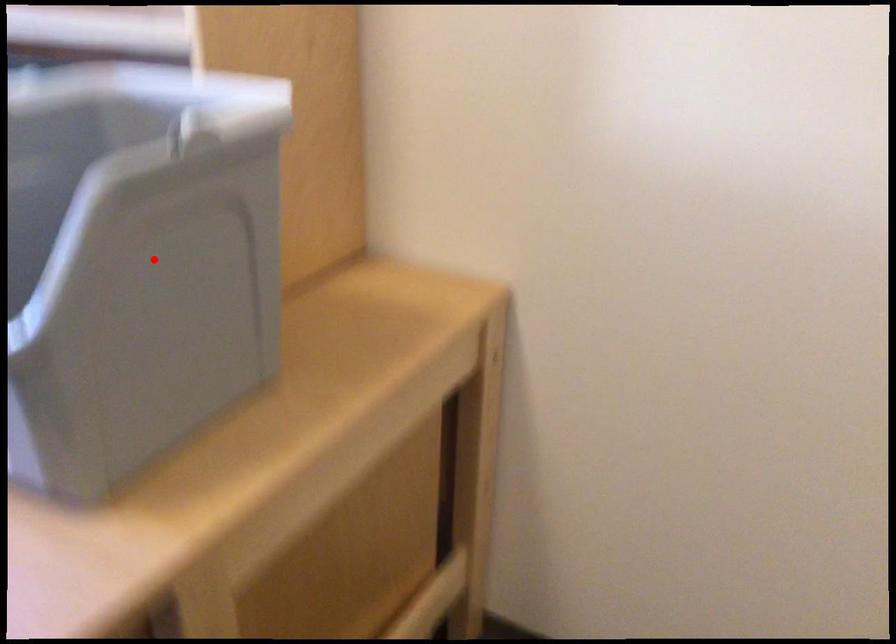
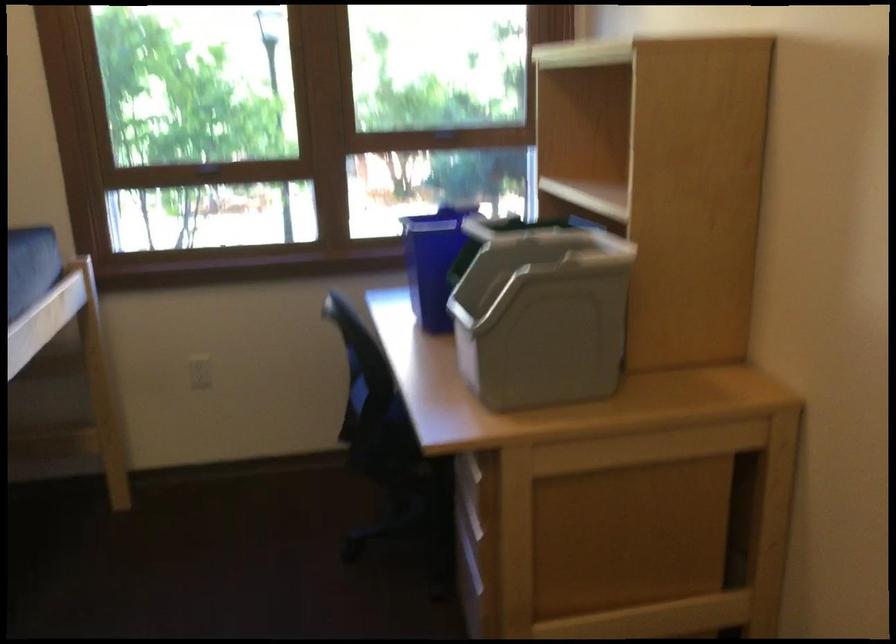
Locate, in the second image, the point that corresponds to the highlighted location in the first image.

(540, 313)